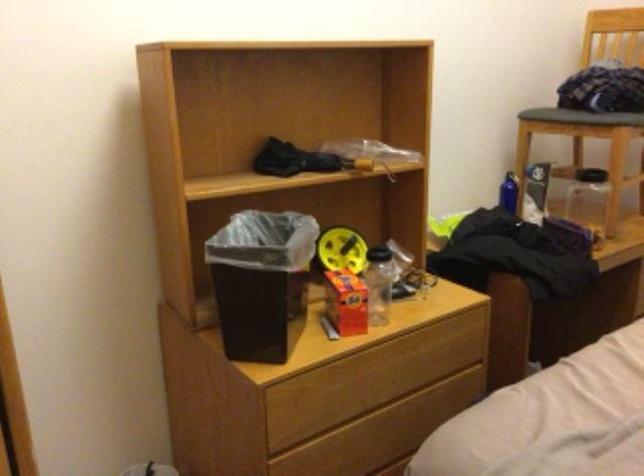
Where would you pull the wooden drawer handle? Please return your answer as a coordinate pair (x, y).

(365, 413)